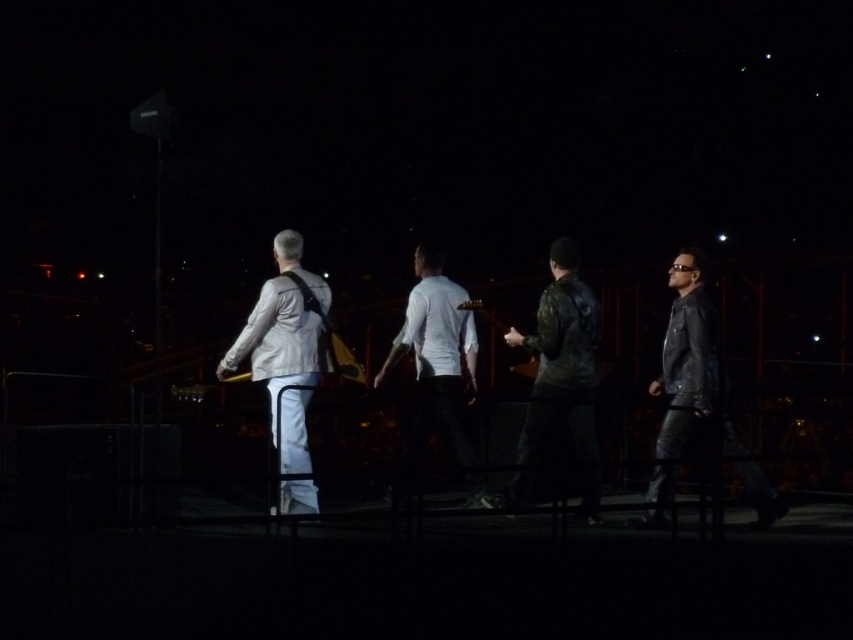
Can you confirm if leather jacket at right is wider than light gray fabric jacket at left?

Yes.

Is leather jacket at right bigger than light gray fabric jacket at left?

Indeed, leather jacket at right has a larger size compared to light gray fabric jacket at left.

Does point (669, 448) come behind point (271, 419)?

No, (669, 448) is in front of (271, 419).

The image size is (853, 640). What are the coordinates of `leather jacket at right` in the screenshot? It's located at [x=698, y=388].

Which is more to the left, leather jacket at right or white matte shirt at center?

white matte shirt at center

Locate an element on the screen. Image resolution: width=853 pixels, height=640 pixels. leather jacket at right is located at coordinates pos(698,388).

Can you confirm if leather jacket at center is positioned to the left of light gray fabric jacket at left?

In fact, leather jacket at center is to the right of light gray fabric jacket at left.

Describe the element at coordinates (561, 378) in the screenshot. The width and height of the screenshot is (853, 640). I see `leather jacket at center` at that location.

Locate an element on the screen. The width and height of the screenshot is (853, 640). leather jacket at center is located at coordinates (561, 378).